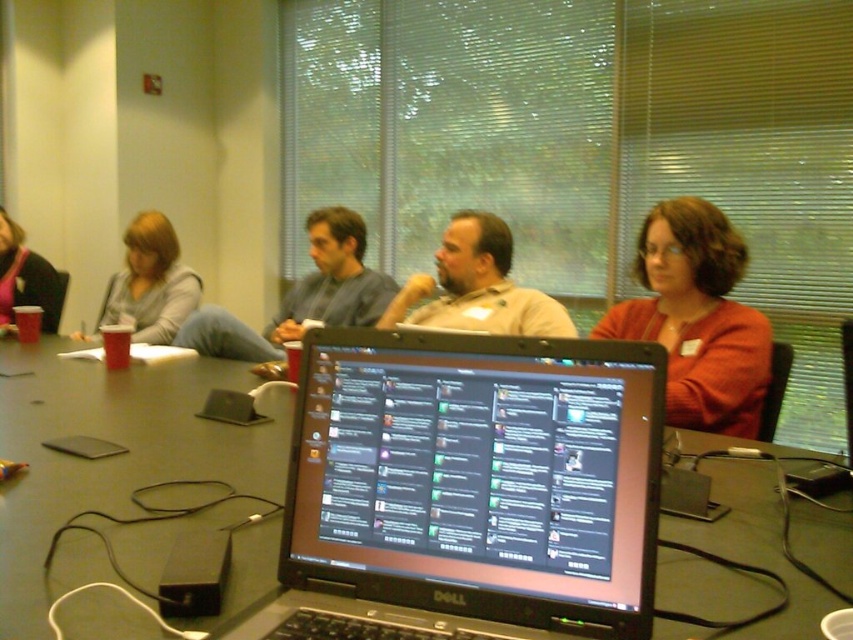
You are sitting at the conference table and need to reach both the point at coordinates point (402,458) and point (131,472). Which point is closer to you?

Point (402,458) is in front of point (131,472), so it is closer to you.

You are organizing a workshop and need to place a large presentation screen on the table. Given the current setup, will there be enough space on the black plastic table at center after placing the black glossy laptop at center?

The black glossy laptop at center occupies less space than the black plastic table at center, so there will be enough space left on the black plastic table at center to place the large presentation screen.